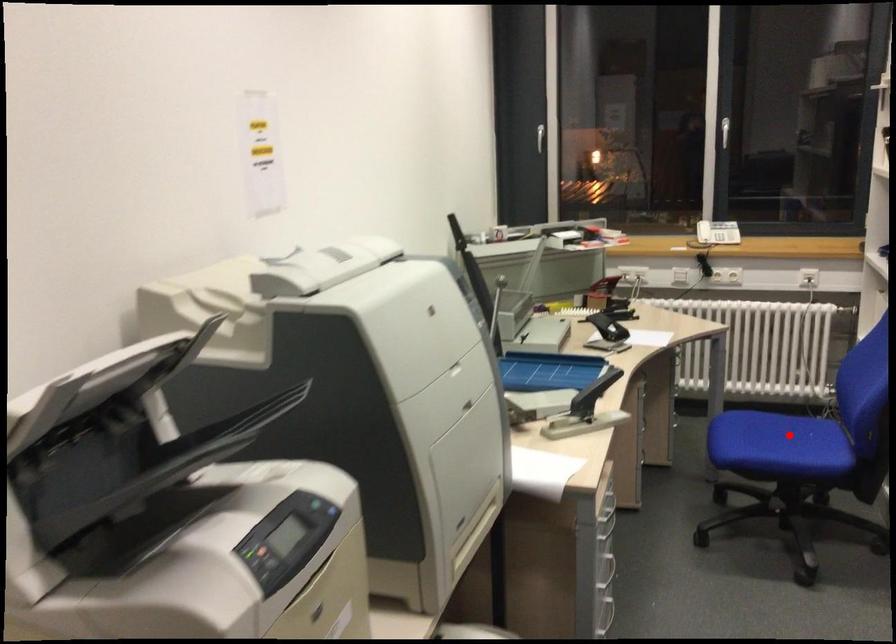
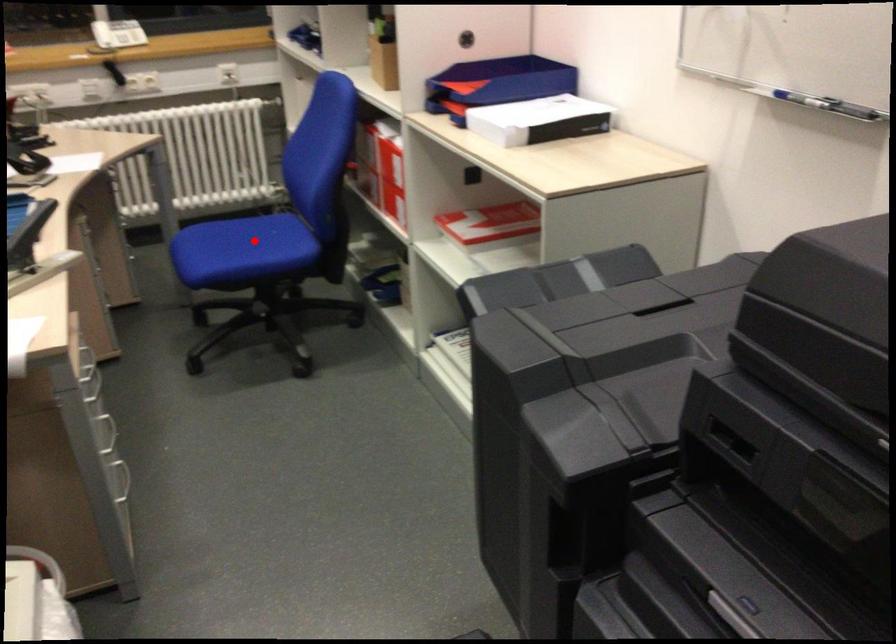
I am providing you with two images of the same scene from different viewpoints. A red point is marked on the first image and another point is marked on the second image. Is the marked point in image1 the same physical position as the marked point in image2?

Yes